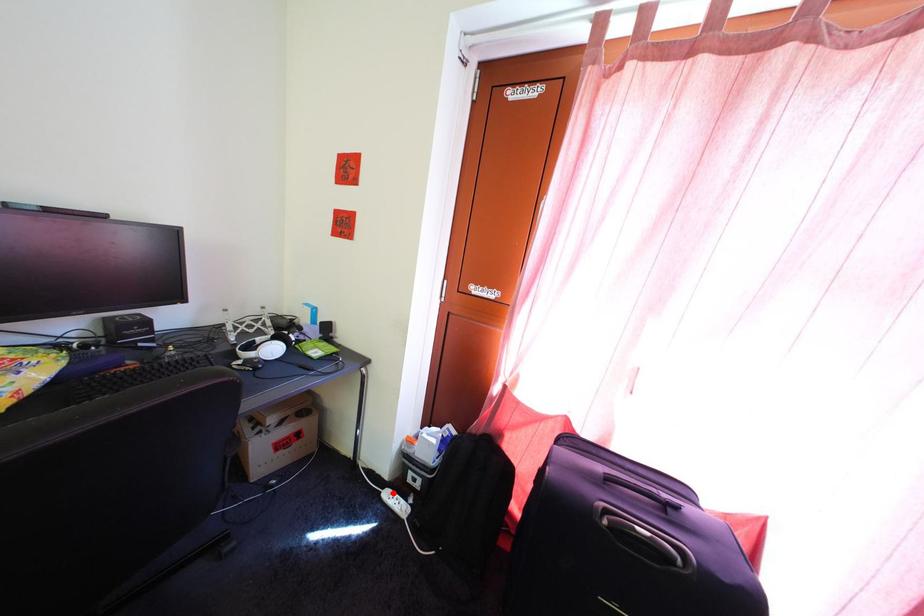
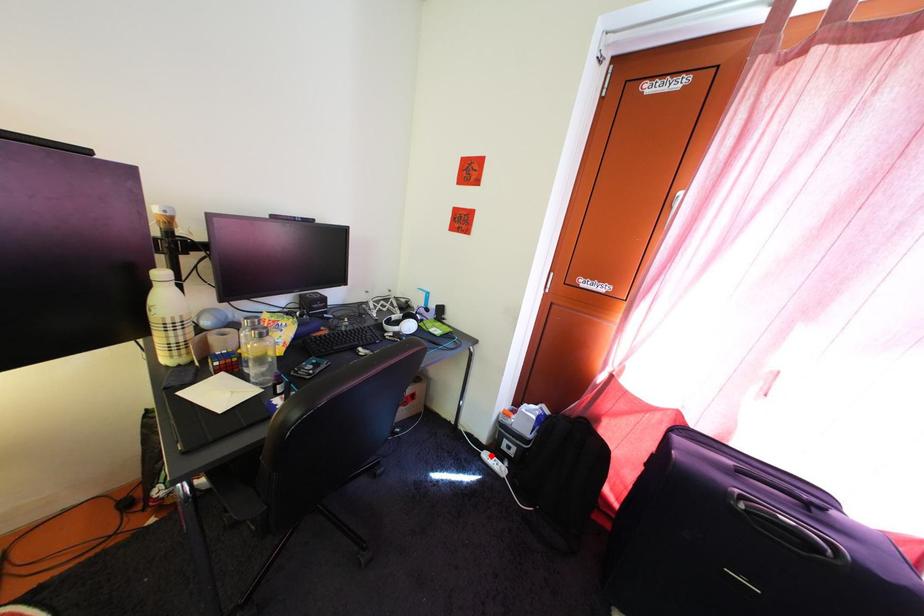
I am providing you with two images of the same scene from different viewpoints. A red point is marked on the first image and another point is marked on the second image. Is the red point in image1 aligned with the point shown in image2?

Yes